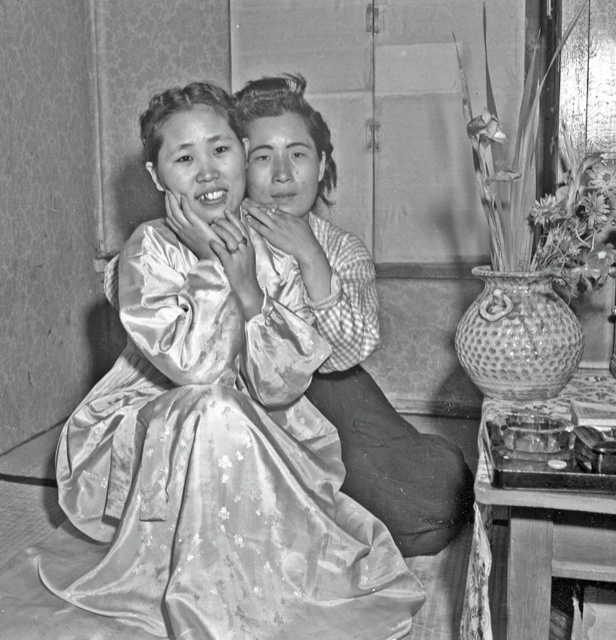
Question: Is silky satin dress at center positioned behind silky satin kimono at center?

Choices:
 (A) no
 (B) yes

Answer: (A)

Question: Is silky satin dress at center wider than silky satin kimono at center?

Choices:
 (A) no
 (B) yes

Answer: (B)

Question: Which object is farther from the camera taking this photo?

Choices:
 (A) silky satin dress at center
 (B) silky satin kimono at center

Answer: (B)

Question: Does silky satin dress at center have a lesser width compared to silky satin kimono at center?

Choices:
 (A) no
 (B) yes

Answer: (A)